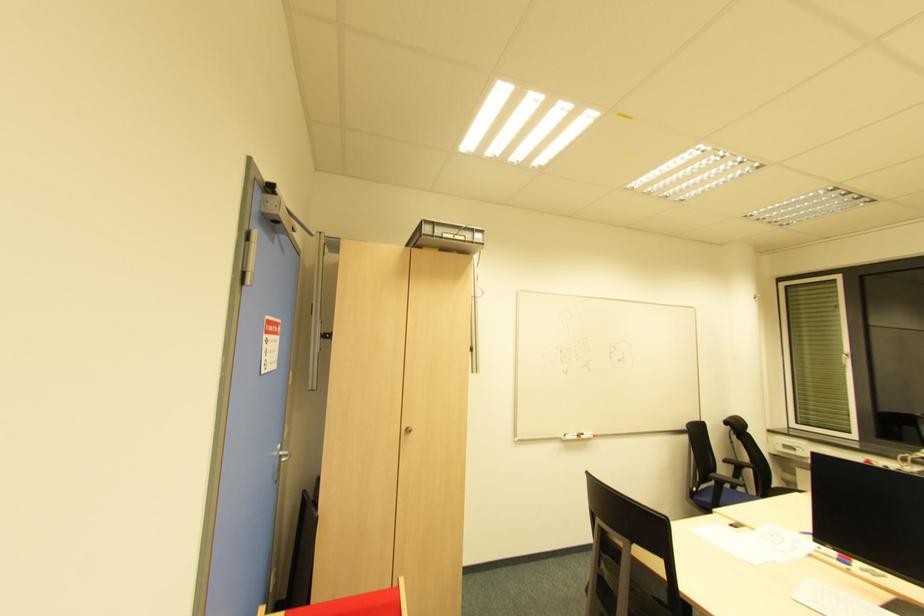
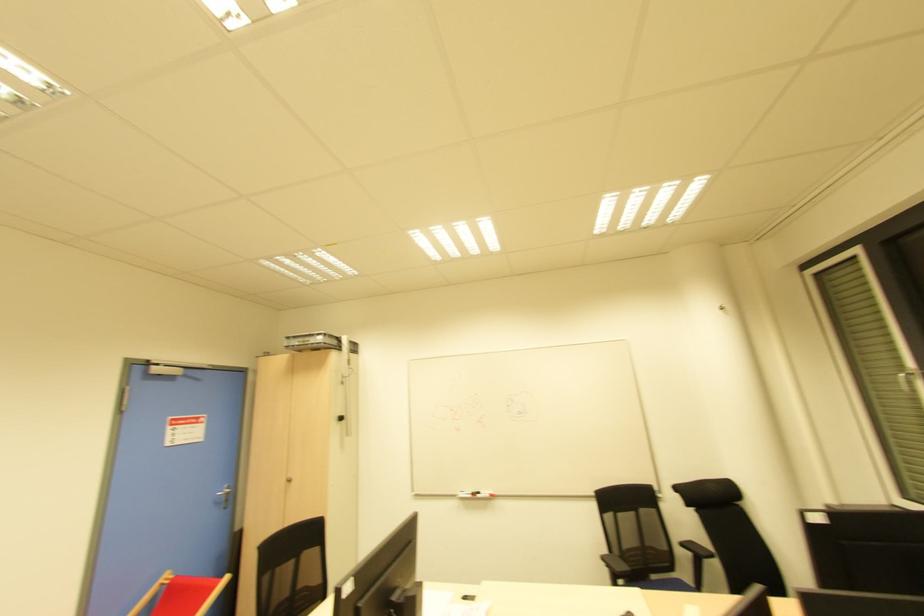
In the second image, find the point that corresponds to the point at 582,438 in the first image.

(478, 496)